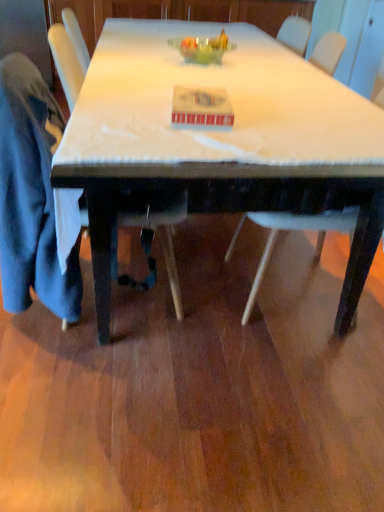
The height and width of the screenshot is (512, 384). I want to click on vacant space in front of translucent glass bowl at center, so click(x=178, y=73).